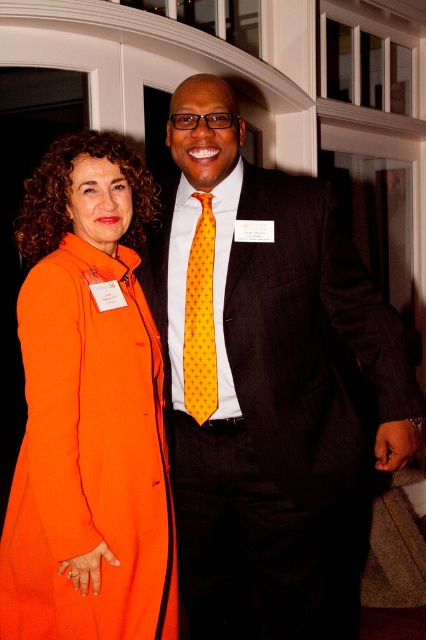
Is matte black suit at center thinner than orange fabric coat at left?

No, matte black suit at center is not thinner than orange fabric coat at left.

Can you confirm if matte black suit at center is positioned to the left of orange fabric coat at left?

No, matte black suit at center is not to the left of orange fabric coat at left.

Who is more forward, (192, 84) or (155, 497)?

Point (155, 497) is more forward.

The image size is (426, 640). Find the location of `matte black suit at center`. matte black suit at center is located at coordinates (267, 385).

Who is lower down, orange fabric coat at left or yellow dotted tie at center?

orange fabric coat at left

Looking at this image, between orange fabric coat at left and yellow dotted tie at center, which one has more height?

orange fabric coat at left is taller.

Does point (42, 168) lie behind point (201, 385)?

That is False.

Find the location of a particular element. orange fabric coat at left is located at coordinates (89, 410).

Is matte black suit at center below yellow dotted tie at center?

Correct, matte black suit at center is located below yellow dotted tie at center.

Which is below, matte black suit at center or yellow dotted tie at center?

matte black suit at center

Find the location of a particular element. The width and height of the screenshot is (426, 640). matte black suit at center is located at coordinates (267, 385).

I want to click on matte black suit at center, so click(x=267, y=385).